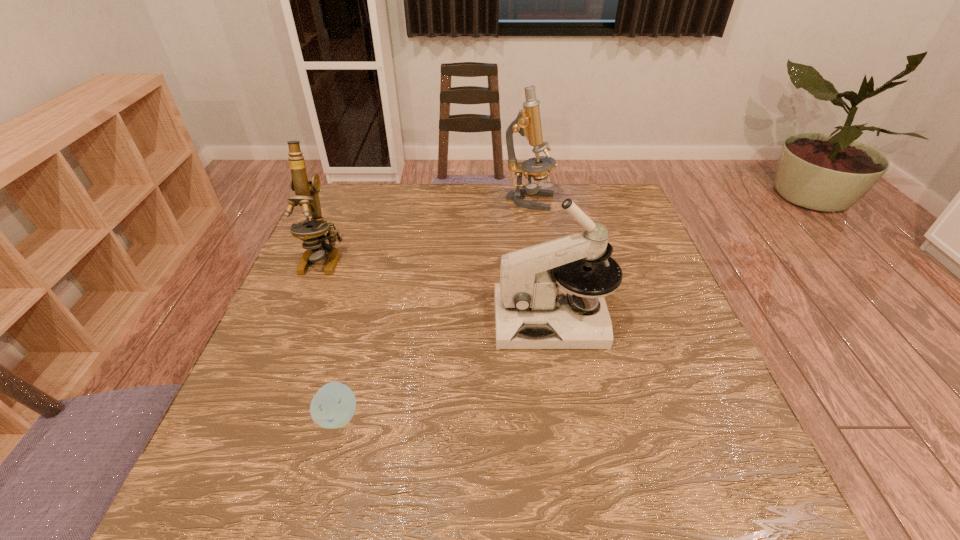
Identify the location of free space between the leftmost object and the second object from left to right. (331, 337).

This screenshot has height=540, width=960. What are the coordinates of `object that is the nearest to the third object from right to left` in the screenshot? It's located at (539, 285).

Image resolution: width=960 pixels, height=540 pixels. I want to click on object that is the third closest to the second nearest object, so click(x=312, y=233).

Identify the location of microscope that stands as the second closest to the third farthest object. This screenshot has width=960, height=540. (312, 233).

Locate an element on the screen. the closest microscope to the apple is located at coordinates (539, 285).

Identify the location of free point that satisfies the following two spatial constraints: 1. on the back side of the second object from left to right; 2. on the right side of the farthest object. (396, 201).

Where is `free space that satisfies the following two spatial constraints: 1. on the front side of the nearest object; 2. on the left side of the second farthest microscope`? The image size is (960, 540). free space that satisfies the following two spatial constraints: 1. on the front side of the nearest object; 2. on the left side of the second farthest microscope is located at coordinates (257, 416).